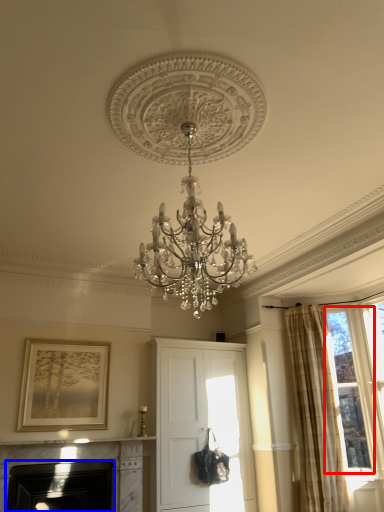
Question: Which point is further to the camera, bay window (highlighted by a red box) or fireplace (highlighted by a blue box)?

Choices:
 (A) bay window
 (B) fireplace

Answer: (A)